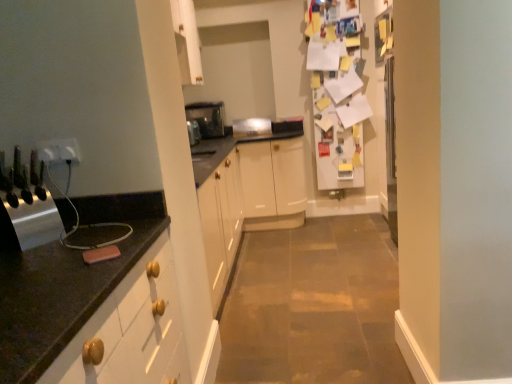
Question: From the image's perspective, is satin silver toaster at center, which is the third appliance in bottom-to-top order, over white plastic outlet at left, which is the first electric outlet in right-to-left order?

Choices:
 (A) no
 (B) yes

Answer: (B)

Question: Is the position of satin silver toaster at center, acting as the second appliance starting from the top, more distant than that of white plastic outlet at left, the second electric outlet from the left?

Choices:
 (A) yes
 (B) no

Answer: (A)

Question: From the image's perspective, is satin silver toaster at center, which is the third appliance in bottom-to-top order, beneath white plastic outlet at left, the second electric outlet from the left?

Choices:
 (A) no
 (B) yes

Answer: (A)

Question: Is satin silver toaster at center, acting as the second appliance starting from the top, facing towards white plastic outlet at left, the second electric outlet from the left?

Choices:
 (A) yes
 (B) no

Answer: (A)

Question: Is satin silver toaster at center, which is the third appliance in bottom-to-top order, bigger than white plastic outlet at left, which is the first electric outlet in right-to-left order?

Choices:
 (A) no
 (B) yes

Answer: (B)

Question: From the image's perspective, is white plastic electric outlet at left, which is counted as the 2th electric outlet, starting from the right, positioned above or below white plastic outlet at left, which is the first electric outlet in right-to-left order?

Choices:
 (A) above
 (B) below

Answer: (B)

Question: In terms of height, does white plastic electric outlet at left, which is the 1th electric outlet in left-to-right order, look taller or shorter compared to white plastic outlet at left, which is the first electric outlet in right-to-left order?

Choices:
 (A) tall
 (B) short

Answer: (B)

Question: Looking at their shapes, would you say white plastic electric outlet at left, which is counted as the 2th electric outlet, starting from the right, is wider or thinner than white plastic outlet at left, the second electric outlet from the left?

Choices:
 (A) thin
 (B) wide

Answer: (B)

Question: Is white plastic electric outlet at left, which is the 1th electric outlet in left-to-right order, in front of or behind white plastic outlet at left, the second electric outlet from the left, in the image?

Choices:
 (A) front
 (B) behind

Answer: (A)

Question: Considering the positions of metallic knife block at left, positioned as the 1th appliance in front-to-back order, and white plastic electric outlet at left, which is counted as the 2th electric outlet, starting from the right, in the image, is metallic knife block at left, positioned as the 1th appliance in front-to-back order, taller or shorter than white plastic electric outlet at left, which is counted as the 2th electric outlet, starting from the right,?

Choices:
 (A) tall
 (B) short

Answer: (A)

Question: In terms of width, does metallic knife block at left, positioned as the 1th appliance in front-to-back order, look wider or thinner when compared to white plastic electric outlet at left, which is counted as the 2th electric outlet, starting from the right?

Choices:
 (A) wide
 (B) thin

Answer: (A)

Question: Is metallic knife block at left, positioned as the 1th appliance in front-to-back order, spatially inside white plastic electric outlet at left, which is counted as the 2th electric outlet, starting from the right, or outside of it?

Choices:
 (A) outside
 (B) inside

Answer: (A)

Question: From a real-world perspective, relative to white plastic electric outlet at left, which is the 1th electric outlet in left-to-right order, is metallic knife block at left, positioned as the 1th appliance in front-to-back order, vertically above or below?

Choices:
 (A) above
 (B) below

Answer: (B)

Question: Considering the positions of point (326, 11) and point (59, 140), is point (326, 11) closer or farther from the camera than point (59, 140)?

Choices:
 (A) closer
 (B) farther

Answer: (B)

Question: In the image, is white paper covered fridge at upper right positioned in front of or behind white plastic outlet at left, which is the first electric outlet in right-to-left order?

Choices:
 (A) front
 (B) behind

Answer: (B)